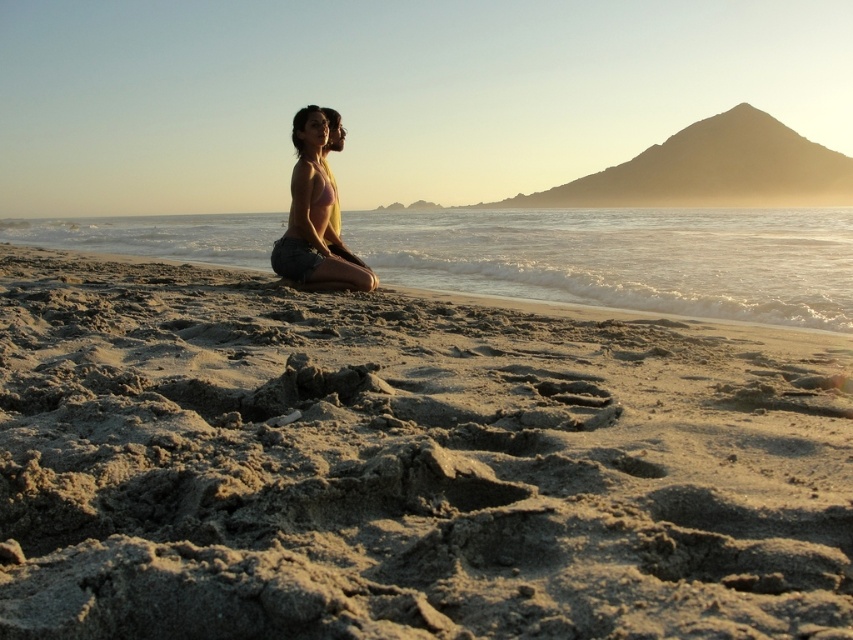
Question: Which point is closer to the camera taking this photo?

Choices:
 (A) (809, 621)
 (B) (328, 280)

Answer: (A)

Question: Does fine-grained sand at center have a greater width compared to matte yellow bikini top at center?

Choices:
 (A) yes
 (B) no

Answer: (A)

Question: From the image, what is the correct spatial relationship of fine-grained sand at center in relation to matte yellow bikini top at center?

Choices:
 (A) right
 (B) left

Answer: (A)

Question: Does fine-grained sand at center have a smaller size compared to matte yellow bikini top at center?

Choices:
 (A) yes
 (B) no

Answer: (A)